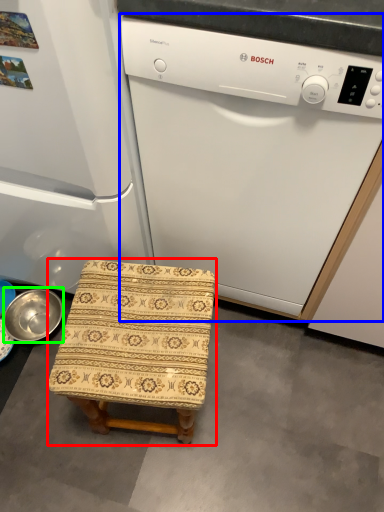
Question: Which is farther away from furniture (highlighted by a red box)? home appliance (highlighted by a blue box) or basin (highlighted by a green box)?

Choices:
 (A) home appliance
 (B) basin

Answer: (B)